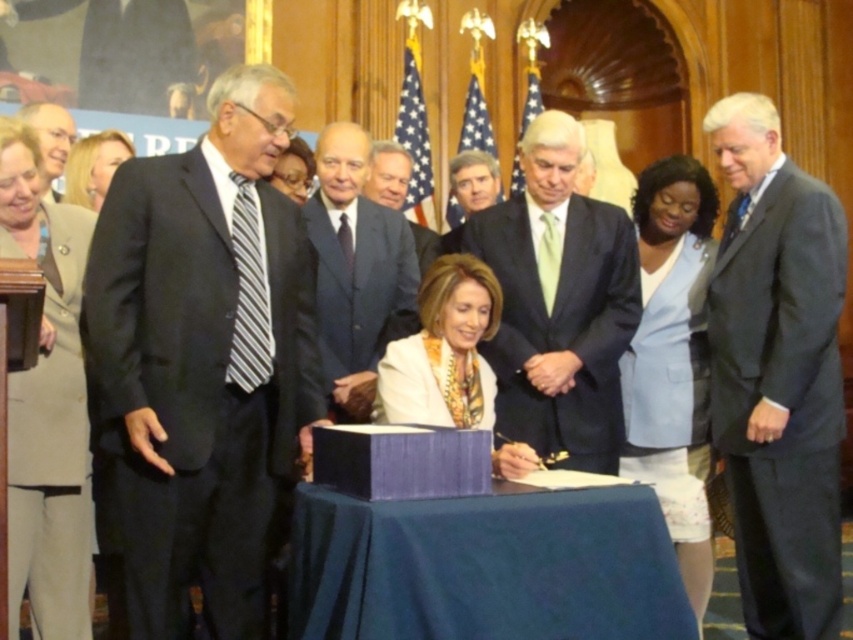
Question: Among these objects, which one is nearest to the camera?

Choices:
 (A) dark gray suit at center
 (B) dark suit at center
 (C) matte black glasses at upper center
 (D) black striped tie at left

Answer: (D)

Question: Which point is farther to the camera?

Choices:
 (A) (83, 189)
 (B) (225, 362)
 (C) (691, 202)

Answer: (C)

Question: Is dark gray suit at right below light beige fabric business suit at left?

Choices:
 (A) yes
 (B) no

Answer: (B)

Question: Can you confirm if light blue suit at center is wider than matte black glasses at upper center?

Choices:
 (A) no
 (B) yes

Answer: (B)

Question: Among these objects, which one is nearest to the camera?

Choices:
 (A) dark gray suit at right
 (B) blue fabric table at center
 (C) dark suit at center
 (D) light blue fabric dress at right

Answer: (B)

Question: Does dark gray suit at center appear on the right side of matte black glasses at upper center?

Choices:
 (A) no
 (B) yes

Answer: (B)